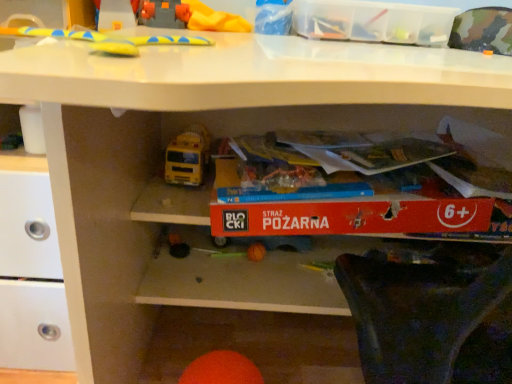
Question: Is point (437, 36) positioned closer to the camera than point (193, 375)?

Choices:
 (A) farther
 (B) closer

Answer: (A)

Question: Is transparent plastic storage box at upper center bigger or smaller than orange matte ball at lower center, the second toy when ordered from front to back?

Choices:
 (A) small
 (B) big

Answer: (B)

Question: Which object is the closest to the yellow rubber toy at upper center, the 3th toy when ordered from front to back?

Choices:
 (A) orange matte ball at lower center, the second toy when ordered from front to back
 (B) yellow rubber toy at upper center, which is counted as the 3th toy, starting from the back
 (C) transparent plastic storage box at upper center

Answer: (B)

Question: Based on their relative distances, which object is farther from the yellow rubber toy at upper center, the first toy positioned from the top?

Choices:
 (A) transparent plastic storage box at upper center
 (B) orange matte ball at lower center, the second toy when ordered from front to back
 (C) yellow rubber toy at upper center, the 2th toy in the bottom-to-top sequence

Answer: (B)